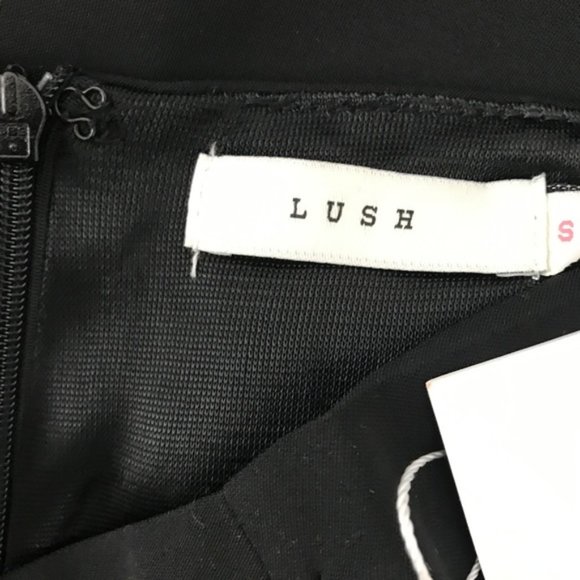
You are a GUI agent. You are given a task and a screenshot of the screen. Output one action in this format:
    pyautogui.click(x=<x>, y=<y>)
    Task: Click on the fabric
    Image resolution: width=580 pixels, height=580 pixels.
    Given the screenshot: What is the action you would take?
    pyautogui.click(x=218, y=395)